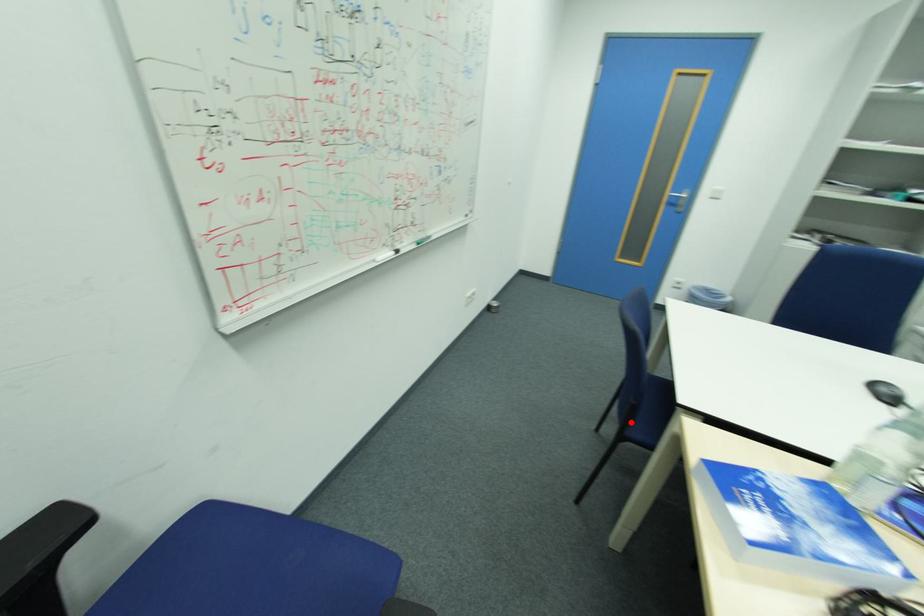
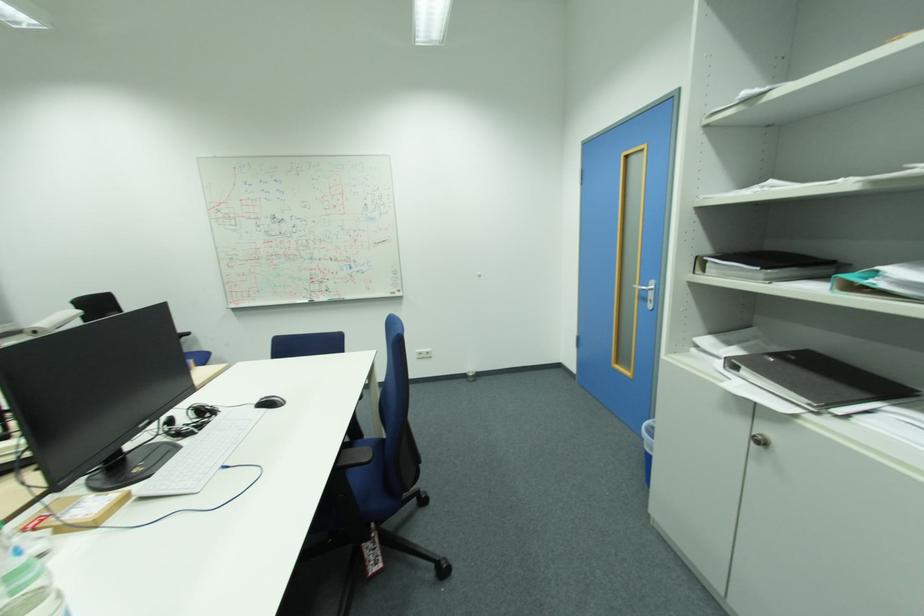
Question: I am providing you with two images of the same scene from different viewpoints. A red point is marked on the first image. At the location where the point appears in image 1, is it still visible in image 2?

Choices:
 (A) Yes
 (B) No

Answer: (B)